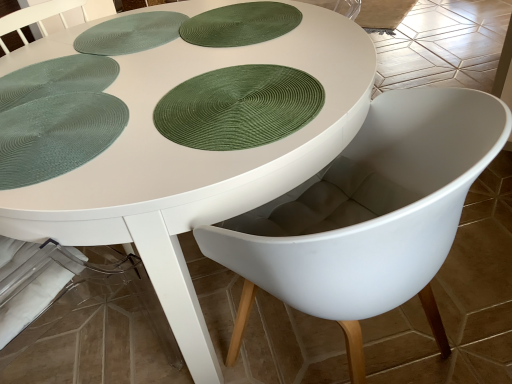
The width and height of the screenshot is (512, 384). I want to click on vacant space to the right of green textured placemat at upper left, so click(242, 35).